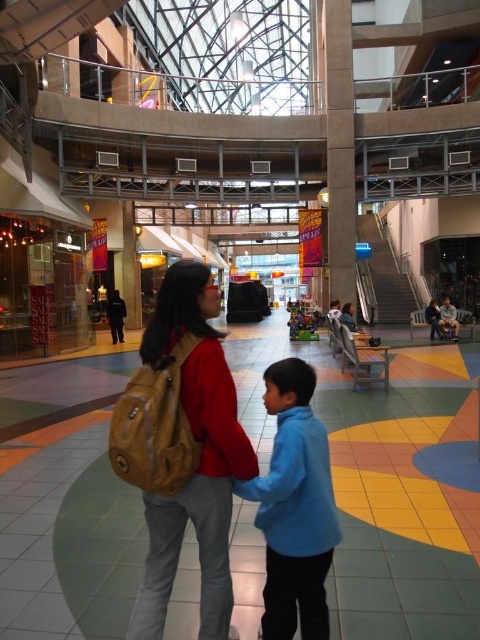
Question: Does leather backpack at center appear on the left side of blue fleece jacket at center?

Choices:
 (A) no
 (B) yes

Answer: (B)

Question: Is leather backpack at center smaller than blue fleece jacket at center?

Choices:
 (A) yes
 (B) no

Answer: (B)

Question: Which point appears farthest from the camera in this image?

Choices:
 (A) (206, 438)
 (B) (266, 408)

Answer: (A)

Question: Does leather backpack at center appear under blue fleece jacket at center?

Choices:
 (A) no
 (B) yes

Answer: (A)

Question: Which object is closer to the camera taking this photo?

Choices:
 (A) leather backpack at center
 (B) blue fleece jacket at center

Answer: (B)

Question: Among these points, which one is farthest from the camera?

Choices:
 (A) (300, 412)
 (B) (169, 321)

Answer: (B)